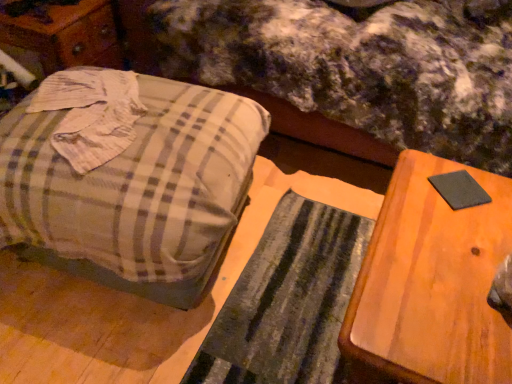
What do you see at coordinates (459, 190) in the screenshot?
I see `black felt pad at right` at bounding box center [459, 190].

From the picture: What is the approximate width of plaid fabric mattress at center?

plaid fabric mattress at center is 3.60 feet in width.

Identify the location of wooden table at right. The width and height of the screenshot is (512, 384). (432, 281).

The image size is (512, 384). I want to click on wooden dresser at left, so click(x=64, y=38).

Can you tell me how much wooden table at right and wooden dresser at left differ in facing direction?

The facing directions of wooden table at right and wooden dresser at left are 92.2 degrees apart.

From a real-world perspective, between wooden table at right and wooden dresser at left, who is vertically higher?

wooden table at right, from a real-world perspective.

Can you confirm if wooden table at right is positioned to the right of wooden dresser at left?

Indeed, wooden table at right is positioned on the right side of wooden dresser at left.

Based on the photo, is wooden table at right directly adjacent to wooden dresser at left?

wooden table at right is not next to wooden dresser at left, and they're not touching.

Identify the location of pad behind the wooden table at right. (459, 190).

From a real-world perspective, is wooden table at right physically above black felt pad at right?

Answer: No, from a real-world perspective, wooden table at right is not above black felt pad at right.

Considering the relative positions of wooden table at right and black felt pad at right in the image provided, is wooden table at right to the right of black felt pad at right from the viewer's perspective?

Incorrect, wooden table at right is not on the right side of black felt pad at right.

Is wooden table at right facing towards black felt pad at right?

No, wooden table at right is not facing towards black felt pad at right.

Is wooden table at right aimed at plaid fabric suitcase at left?

No, wooden table at right is not oriented towards plaid fabric suitcase at left.

Does wooden table at right come behind plaid fabric suitcase at left?

No, it is not.

Who is bigger, wooden table at right or plaid fabric suitcase at left?

Bigger between the two is plaid fabric suitcase at left.

Is wooden table at right spatially inside plaid fabric suitcase at left, or outside of it?

wooden table at right is outside plaid fabric suitcase at left.

In the scene shown: Based on their sizes in the image, would you say wooden table at right is bigger or smaller than plaid fabric mattress at center?

Considering their sizes, wooden table at right takes up less space than plaid fabric mattress at center.

From a real-world perspective, is wooden table at right over plaid fabric mattress at center?

No.

Could you tell me if wooden table at right is facing plaid fabric mattress at center?

No, wooden table at right is not turned towards plaid fabric mattress at center.

Find the location of `mattress on the left of wooden table at right`. mattress on the left of wooden table at right is located at coordinates (360, 65).

Does wooden dresser at left have a greater height compared to black felt pad at right?

Yes.

Can you confirm if wooden dresser at left is smaller than black felt pad at right?

No.

In the scene shown: Can you confirm if wooden dresser at left is positioned to the left of black felt pad at right?

Correct, you'll find wooden dresser at left to the left of black felt pad at right.

From a real-world perspective, which is physically below, plaid fabric mattress at center or wooden dresser at left?

In real-world perspective, wooden dresser at left is lower.

From the image's perspective, does plaid fabric mattress at center appear lower than wooden dresser at left?

No, from the image's perspective, plaid fabric mattress at center is not beneath wooden dresser at left.

Is plaid fabric mattress at center turned away from wooden dresser at left?

No, wooden dresser at left is not at the back of plaid fabric mattress at center.

Considering the relative sizes of plaid fabric mattress at center and wooden dresser at left in the image provided, is plaid fabric mattress at center smaller than wooden dresser at left?

No.

How different are the orientations of plaid fabric suitcase at left and wooden table at right in degrees?

There is a 9.7-degree angle between the facing directions of plaid fabric suitcase at left and wooden table at right.

Is there a large distance between plaid fabric suitcase at left and wooden table at right?

No, plaid fabric suitcase at left is not far away from wooden table at right.

Could you tell me if plaid fabric suitcase at left is turned towards wooden table at right?

No, plaid fabric suitcase at left is not aimed at wooden table at right.

Who is taller, plaid fabric suitcase at left or wooden table at right?

plaid fabric suitcase at left.

This screenshot has height=384, width=512. In order to click on dresser behind the wooden table at right in this screenshot , I will do `click(64, 38)`.

Where is `table in front of the black felt pad at right`? table in front of the black felt pad at right is located at coordinates (432, 281).

Considering their positions, is wooden table at right positioned further to plaid fabric suitcase at left than wooden dresser at left?

wooden dresser at left is positioned further to the anchor plaid fabric suitcase at left.

When comparing their distances from wooden dresser at left, does plaid fabric mattress at center or plaid fabric suitcase at left seem further?

Among the two, plaid fabric mattress at center is located further to wooden dresser at left.

Based on their spatial positions, is plaid fabric mattress at center or black felt pad at right further from plaid fabric suitcase at left?

black felt pad at right lies further to plaid fabric suitcase at left than the other object.

From the image, which object appears to be nearer to wooden dresser at left, plaid fabric mattress at center or wooden table at right?

plaid fabric mattress at center is closer to wooden dresser at left.

Looking at the image, which one is located closer to wooden dresser at left, plaid fabric suitcase at left or plaid fabric mattress at center?

Among the two, plaid fabric suitcase at left is located nearer to wooden dresser at left.

Based on their spatial positions, is wooden table at right or black felt pad at right further from plaid fabric suitcase at left?

black felt pad at right is positioned further to the anchor plaid fabric suitcase at left.

Looking at the image, which one is located closer to black felt pad at right, wooden dresser at left or plaid fabric suitcase at left?

plaid fabric suitcase at left is closer to black felt pad at right.

Looking at the image, which one is located further to plaid fabric suitcase at left, plaid fabric mattress at center or wooden dresser at left?

wooden dresser at left lies further to plaid fabric suitcase at left than the other object.

The image size is (512, 384). What are the coordinates of `furniture between wooden dresser at left and black felt pad at right` in the screenshot? It's located at (127, 178).

Where is `furniture between plaid fabric mattress at center and wooden table at right vertically`? furniture between plaid fabric mattress at center and wooden table at right vertically is located at coordinates [x=127, y=178].

Find the location of a particular element. This screenshot has width=512, height=384. furniture situated between wooden dresser at left and plaid fabric mattress at center from left to right is located at coordinates (127, 178).

This screenshot has height=384, width=512. What are the coordinates of `mattress situated between wooden dresser at left and wooden table at right from left to right` in the screenshot? It's located at (360, 65).